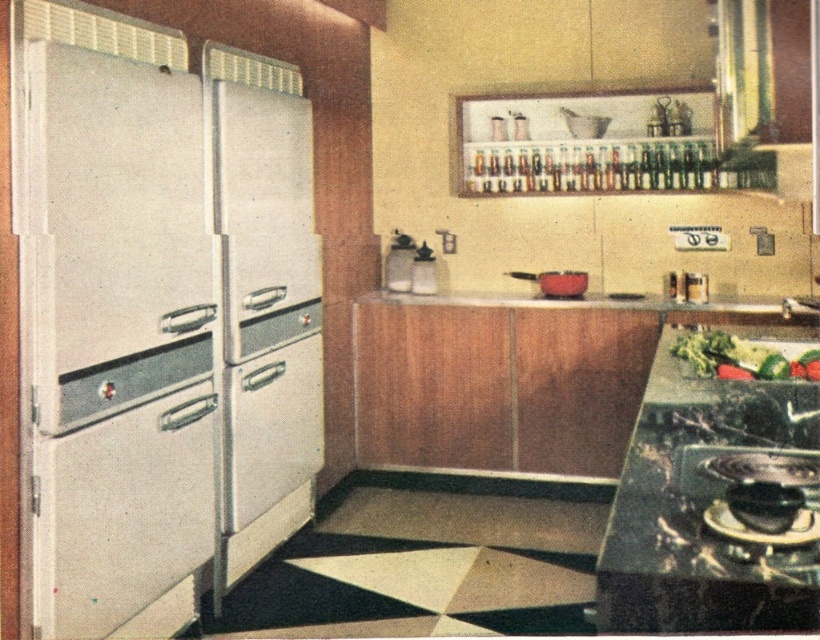
Question: In this image, where is metallic gray refrigerator at left located relative to red matte pot at center?

Choices:
 (A) left
 (B) right

Answer: (A)

Question: Is metallic gray refrigerator at left positioned behind red matte pot at center?

Choices:
 (A) no
 (B) yes

Answer: (A)

Question: Is metallic gray refrigerator at left further to the viewer compared to red matte pot at center?

Choices:
 (A) no
 (B) yes

Answer: (A)

Question: Considering the real-world distances, which object is farthest from the smooth white countertop at center?

Choices:
 (A) red matte pot at center
 (B) metallic gray refrigerator at left

Answer: (B)

Question: Which object is farther from the camera taking this photo?

Choices:
 (A) smooth white countertop at center
 (B) metallic gray refrigerator at left
 (C) red matte pot at center

Answer: (C)

Question: Which point is farther to the camera?

Choices:
 (A) (538, 300)
 (B) (581, 285)
 (C) (162, 273)

Answer: (B)